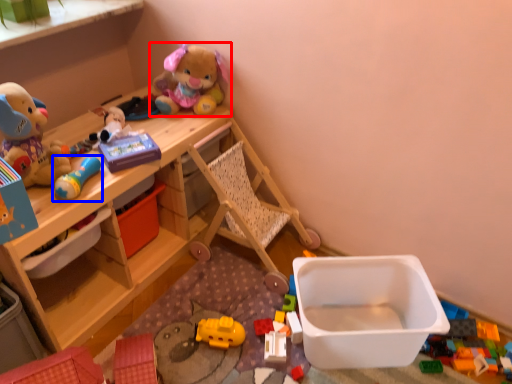
Question: Which of the following is the farthest to the observer, toy (highlighted by a red box) or toy (highlighted by a blue box)?

Choices:
 (A) toy
 (B) toy

Answer: (A)